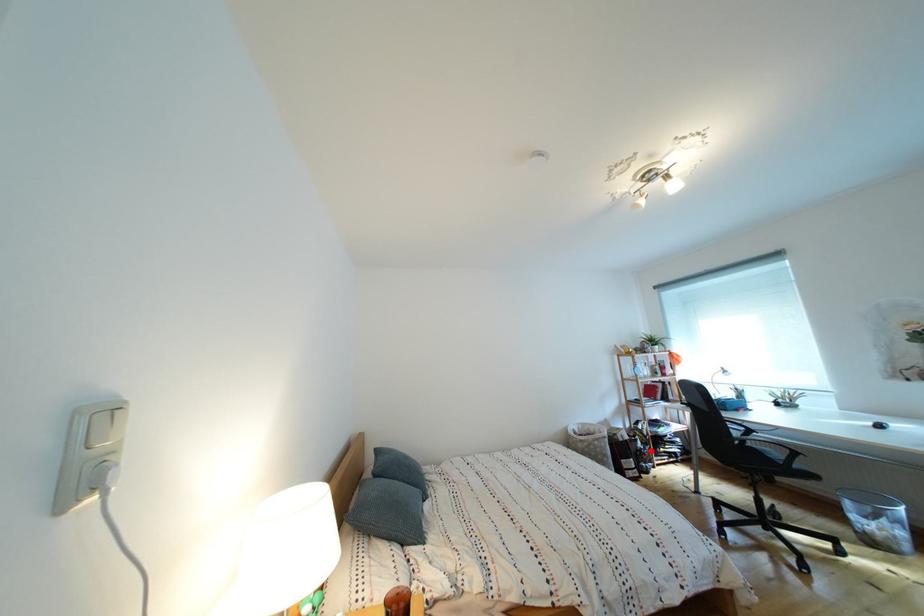
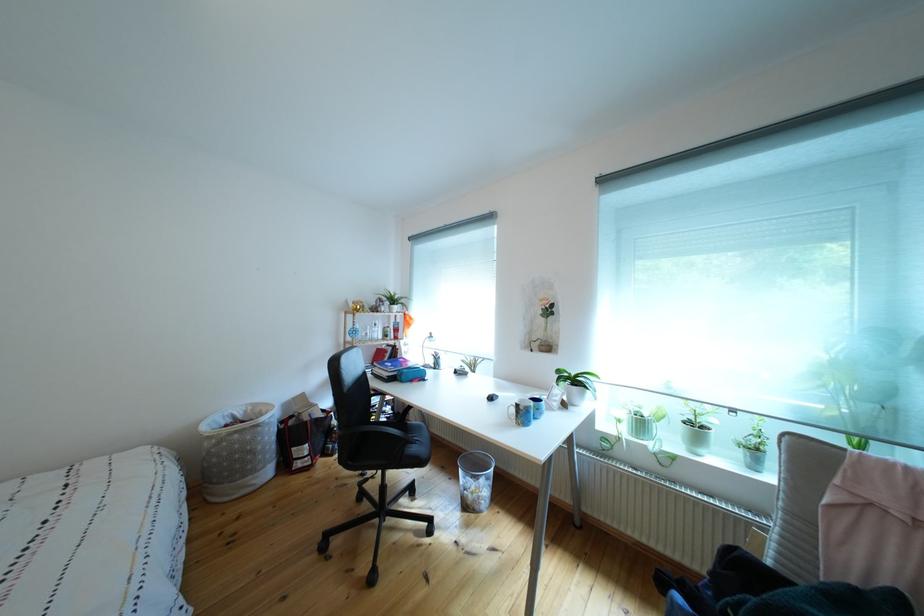
In the second image, find the point that corresponds to the highlighted location in the first image.

(346, 428)